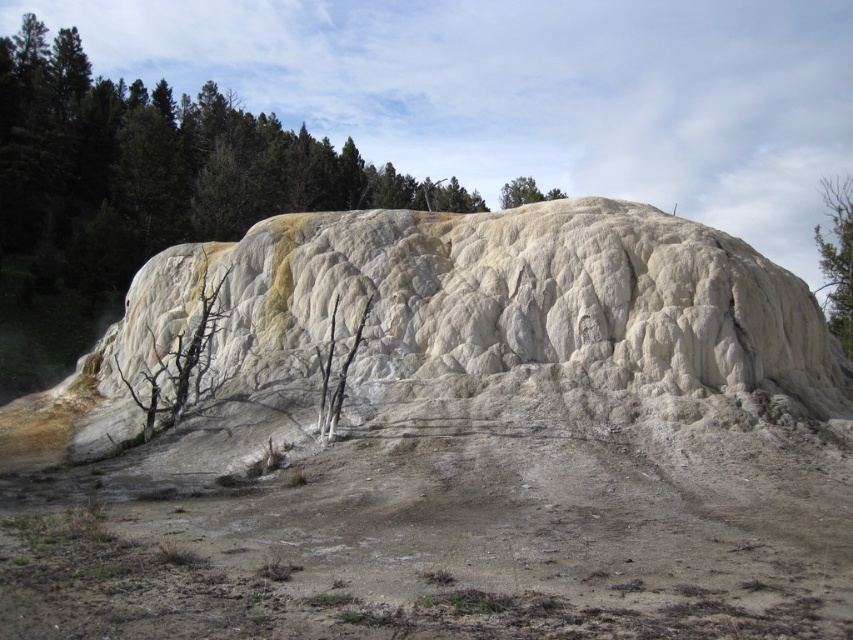
Can you confirm if dull brown dirt track at lower center is positioned above white textured rock at center?

Actually, dull brown dirt track at lower center is below white textured rock at center.

What are the coordinates of `dull brown dirt track at lower center` in the screenshot? It's located at (438, 541).

Is point (196, 556) positioned in front of point (437, 212)?

Yes.

Identify the location of dull brown dirt track at lower center. (438, 541).

Is dull brown dirt track at lower center to the left of green leafy tree at upper right from the viewer's perspective?

Correct, you'll find dull brown dirt track at lower center to the left of green leafy tree at upper right.

Between point (296, 520) and point (848, 333), which one is positioned behind?

Positioned behind is point (848, 333).

Locate an element on the screen. The image size is (853, 640). dull brown dirt track at lower center is located at coordinates (438, 541).

Between white textured rock at center and green leafy tree at upper right, which one has more height?

Standing taller between the two is green leafy tree at upper right.

Does white textured rock at center come in front of green leafy tree at upper right?

Yes, white textured rock at center is in front of green leafy tree at upper right.

The width and height of the screenshot is (853, 640). Describe the element at coordinates (485, 310) in the screenshot. I see `white textured rock at center` at that location.

Find the location of a particular element. white textured rock at center is located at coordinates (485, 310).